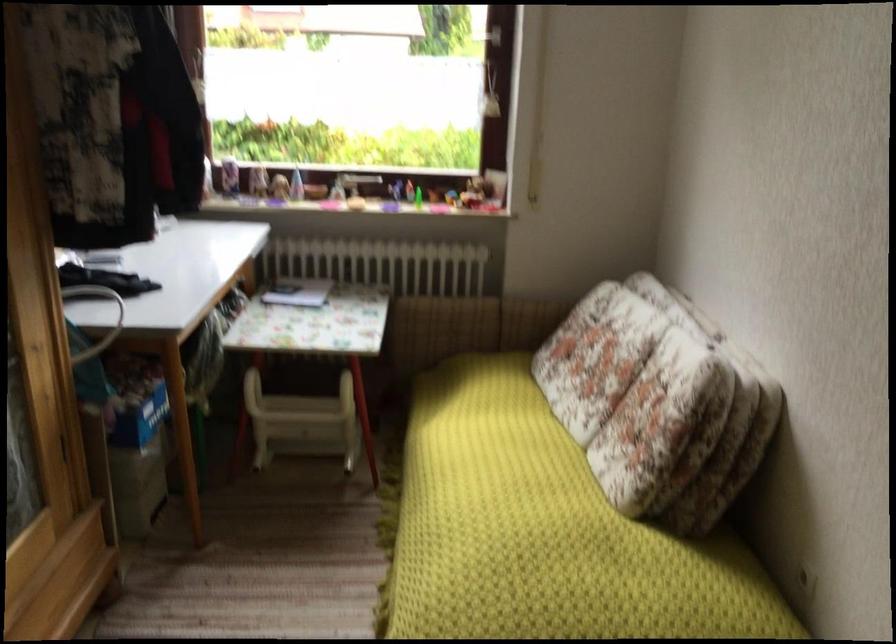
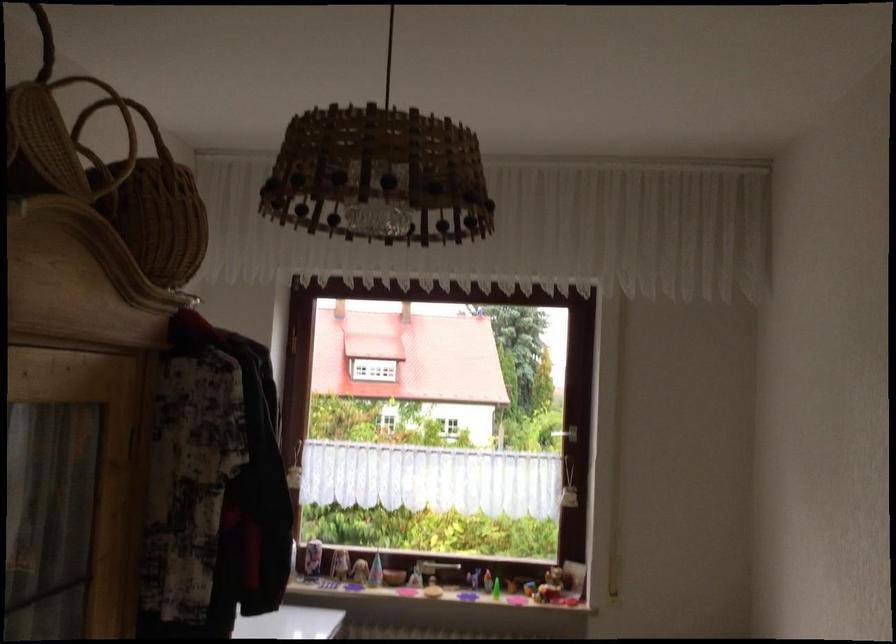
Question: The first image is from the beginning of the video and the second image is from the end. How did the camera likely rotate when shooting the video?

Choices:
 (A) Left
 (B) Right
 (C) Up
 (D) Down

Answer: (C)